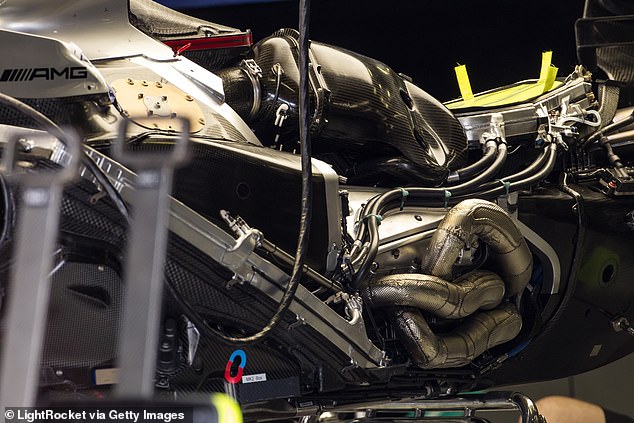
Locate an element on the screen. cord is located at coordinates (304, 206).